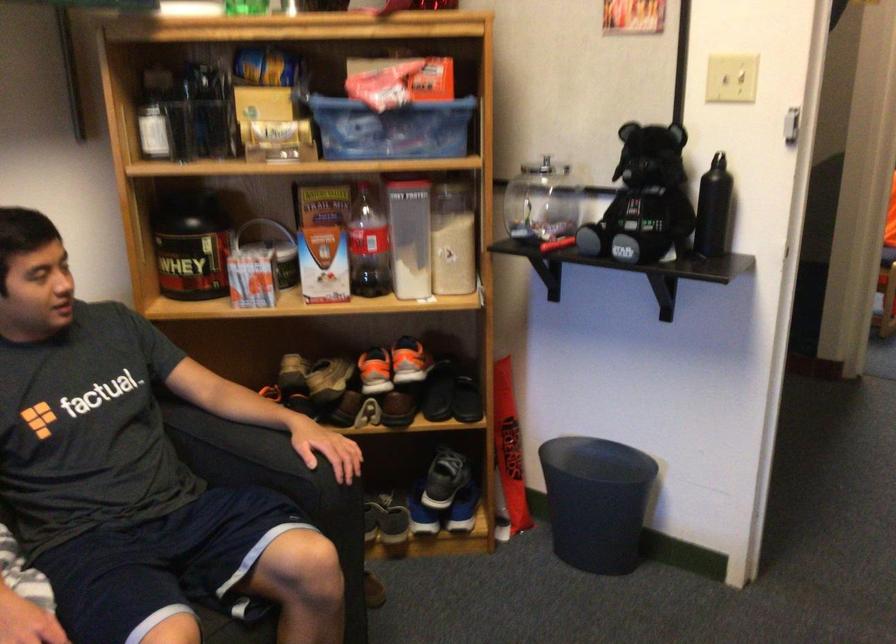
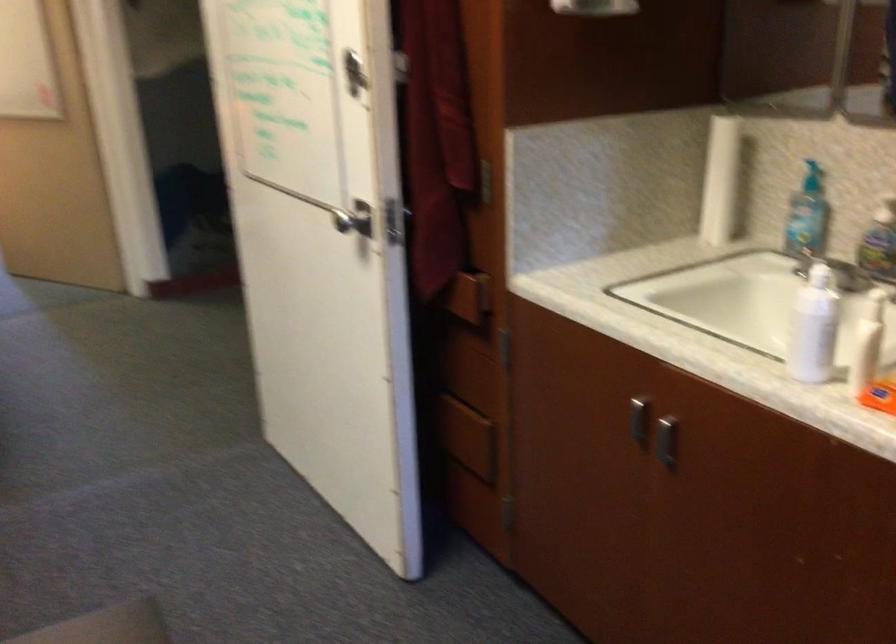
Question: The first image is from the beginning of the video and the second image is from the end. How did the camera likely rotate when shooting the video?

Choices:
 (A) Left
 (B) Right
 (C) Up
 (D) Down

Answer: (B)